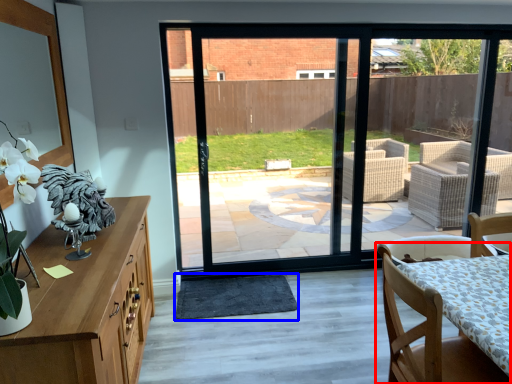
Question: Which object is closer to the camera taking this photo, chair (highlighted by a red box) or wide (highlighted by a blue box)?

Choices:
 (A) chair
 (B) wide

Answer: (A)